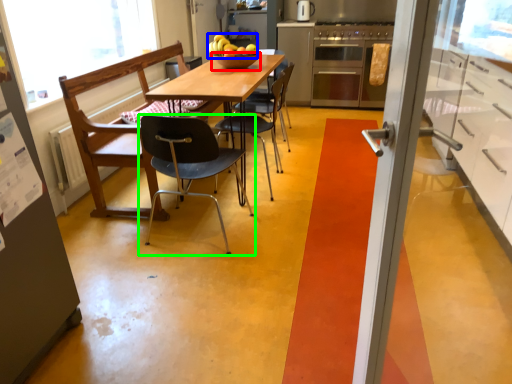
Question: Based on their relative distances, which object is farther from bowl (highlighted by a red box)? Choose from fruit (highlighted by a blue box) and chair (highlighted by a green box).

Choices:
 (A) fruit
 (B) chair

Answer: (B)